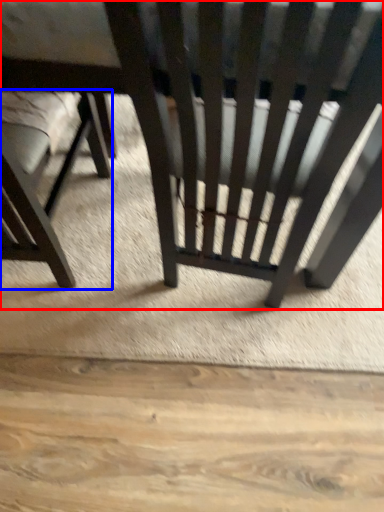
Question: Which point is closer to the camera, chair (highlighted by a red box) or chair (highlighted by a blue box)?

Choices:
 (A) chair
 (B) chair

Answer: (A)